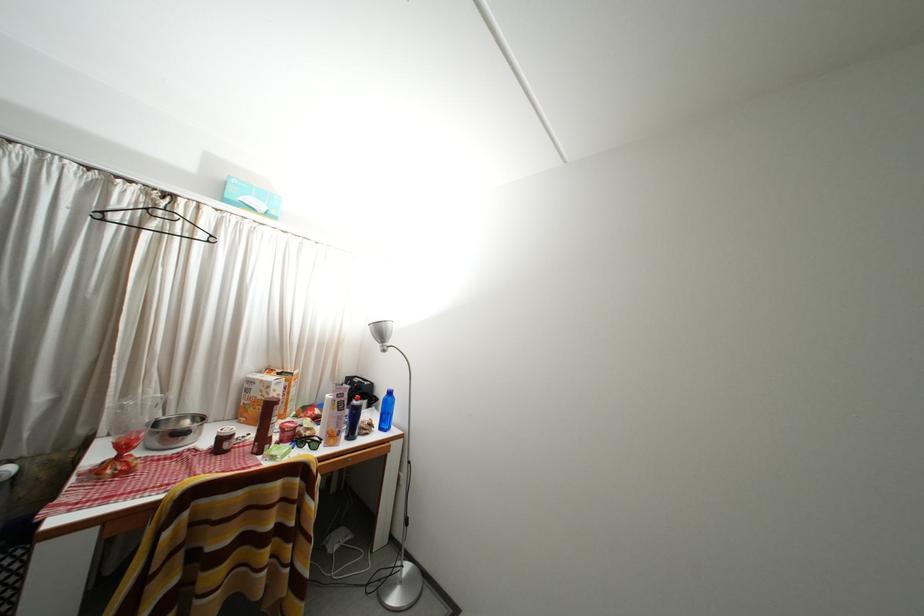
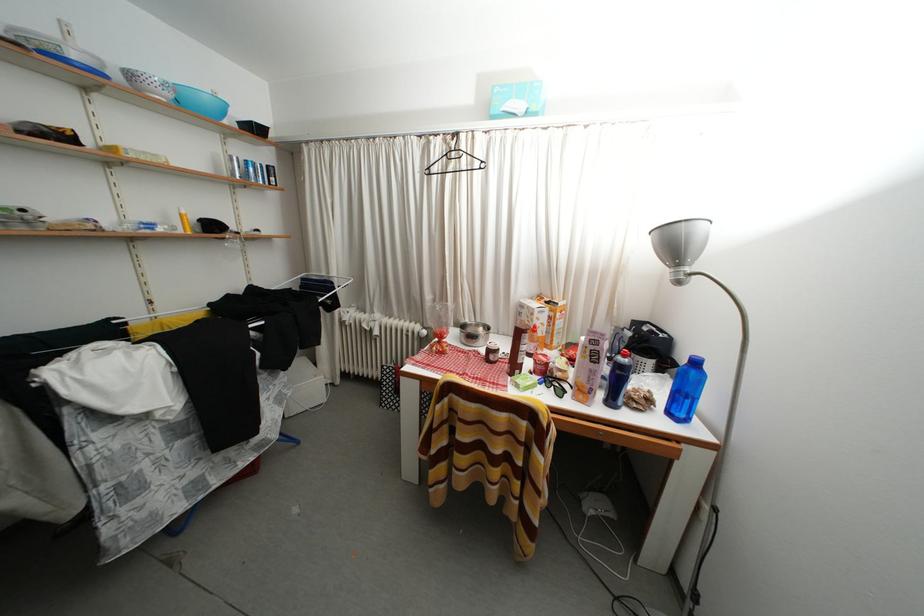
Question: I am providing you with two images of the same scene from different viewpoints. After the viewpoint changes to image2, which objects are now occluded?

Choices:
 (A) blue water bottle
 (B) black bottle
 (C) metal mixing bowl
 (D) none of these

Answer: (D)